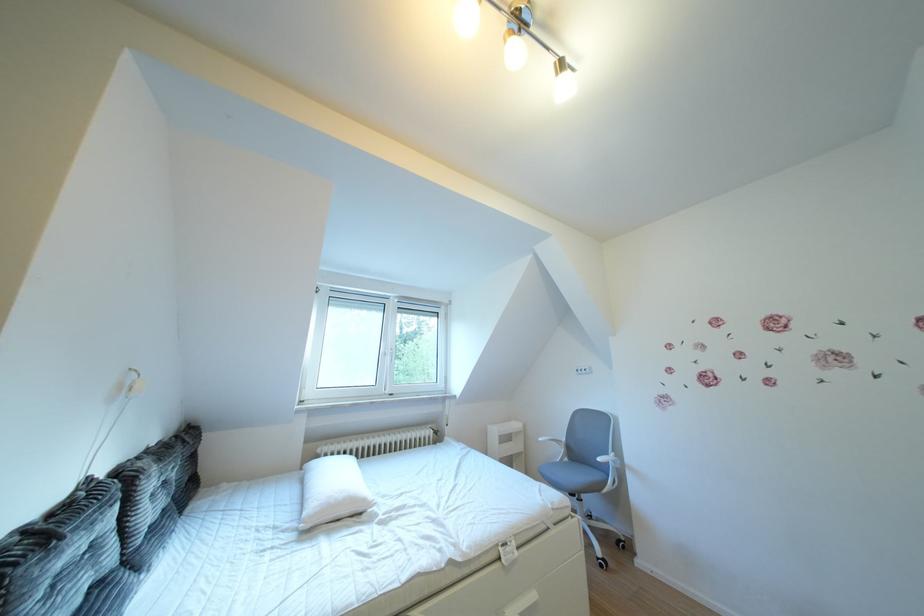
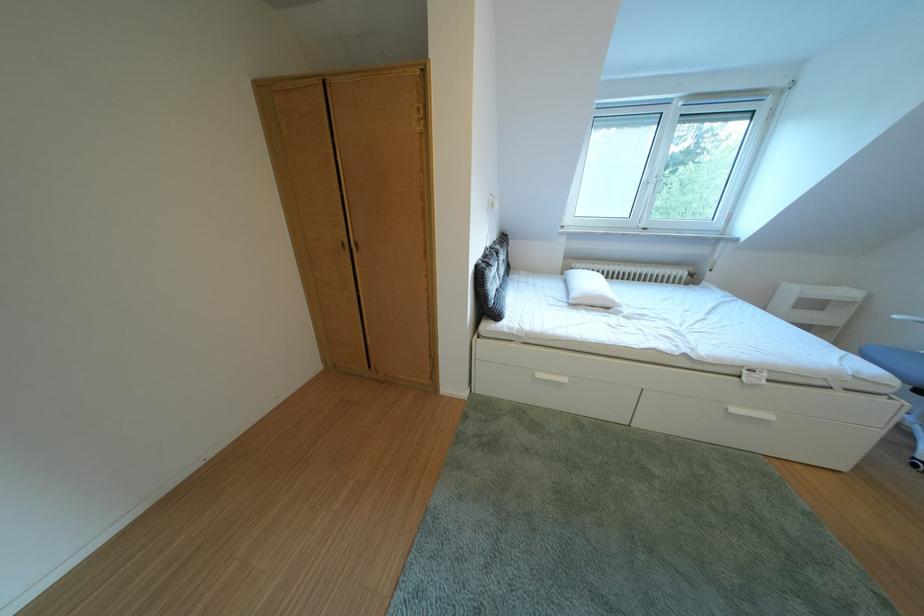
Where in the second image is the point corresponding to point (333, 456) from the first image?

(588, 270)